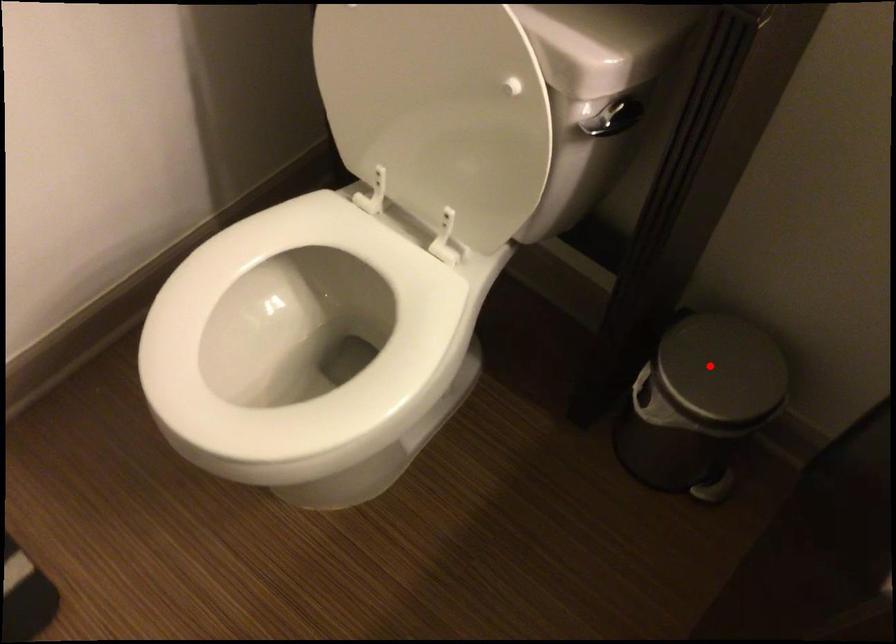
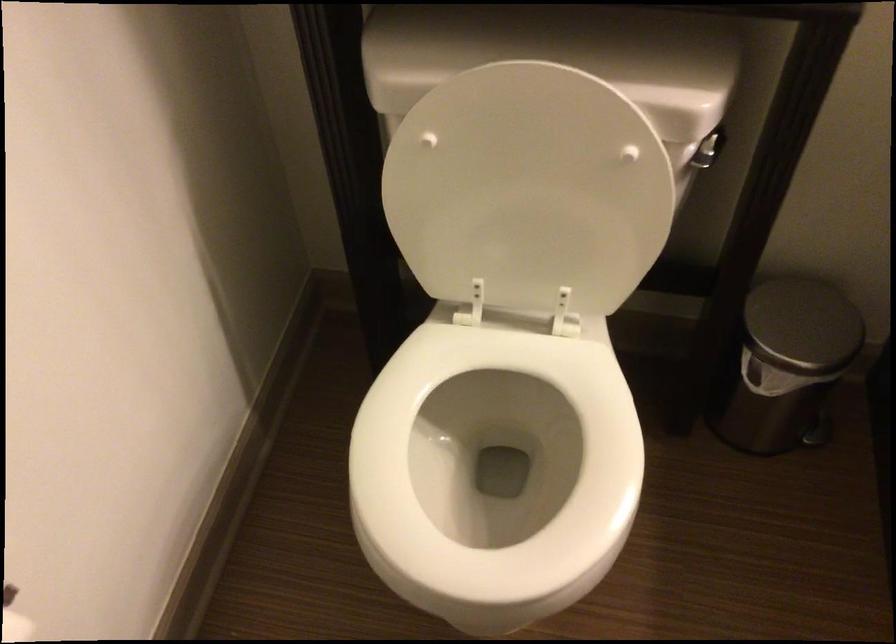
Locate, in the second image, the point that corresponds to the highlighted location in the first image.

(803, 325)